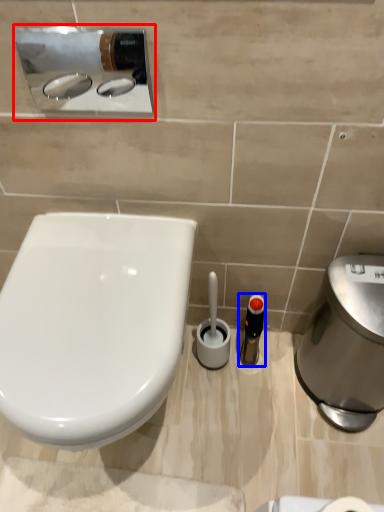
Question: Which point is closer to the camera, sink (highlighted by a red box) or toiletry (highlighted by a blue box)?

Choices:
 (A) sink
 (B) toiletry

Answer: (A)